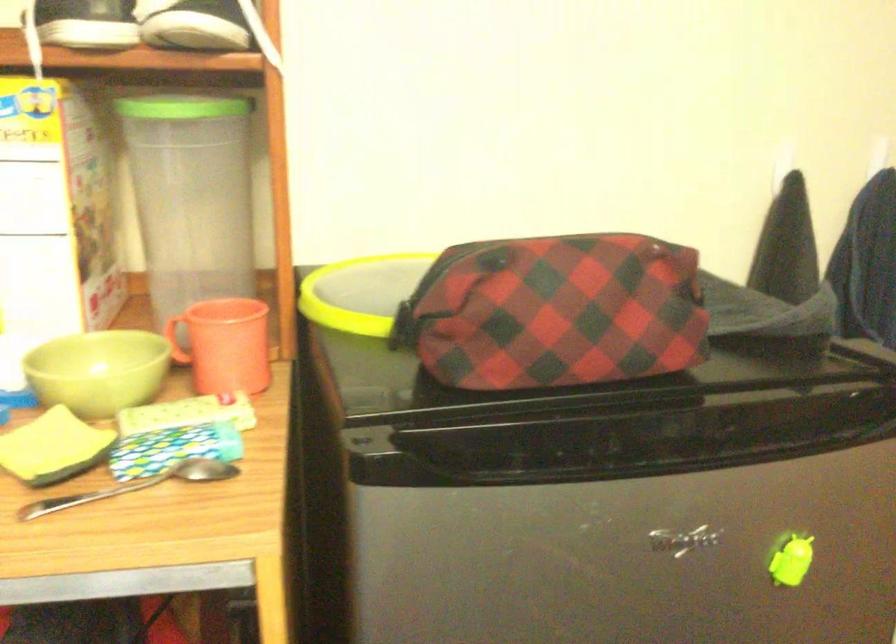
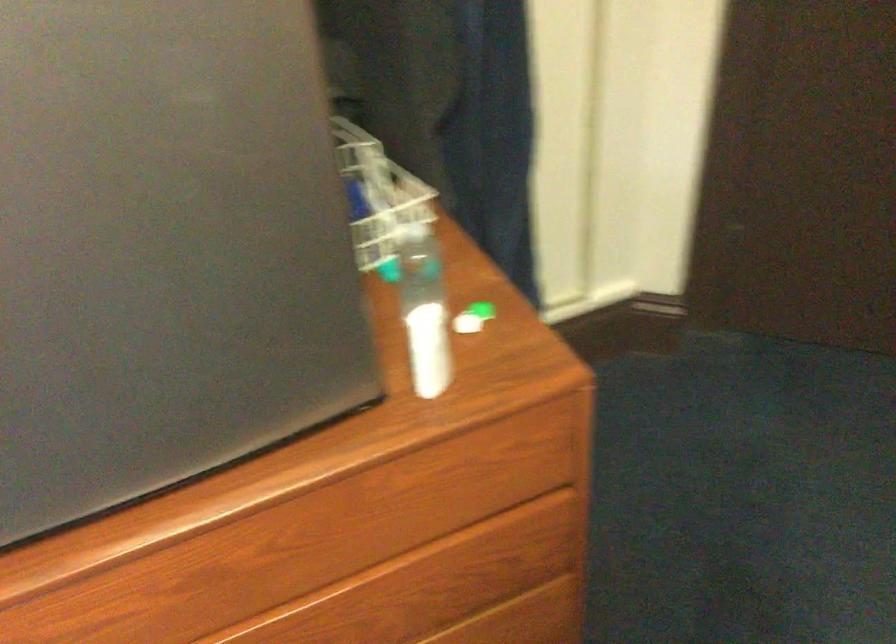
Question: What movement of the cameraman would produce the second image?

Choices:
 (A) Left
 (B) Right
 (C) Forward
 (D) Backward

Answer: (B)